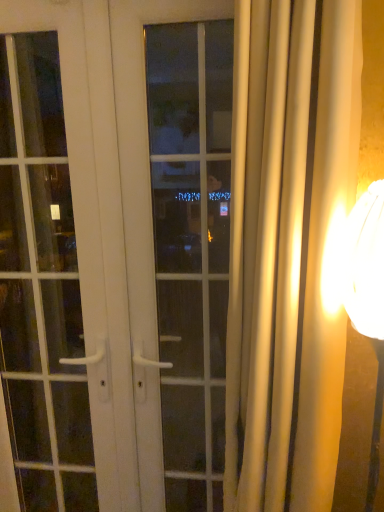
Question: Is matte gold lampshade at right to the left or to the right of white glossy door handle at left in the image?

Choices:
 (A) right
 (B) left

Answer: (A)

Question: Relative to white glossy door handle at left, is matte gold lampshade at right in front or behind?

Choices:
 (A) behind
 (B) front

Answer: (B)

Question: Which of these objects is positioned closest to the silky beige curtain at right?

Choices:
 (A) white glossy door at center
 (B) white glossy door handle at left
 (C) matte gold lampshade at right
 (D) white glass window at center

Answer: (C)

Question: Based on their relative distances, which object is farther from the white glossy door handle at left?

Choices:
 (A) silky beige curtain at right
 (B) white glass window at center
 (C) matte gold lampshade at right
 (D) white glossy door at center

Answer: (B)